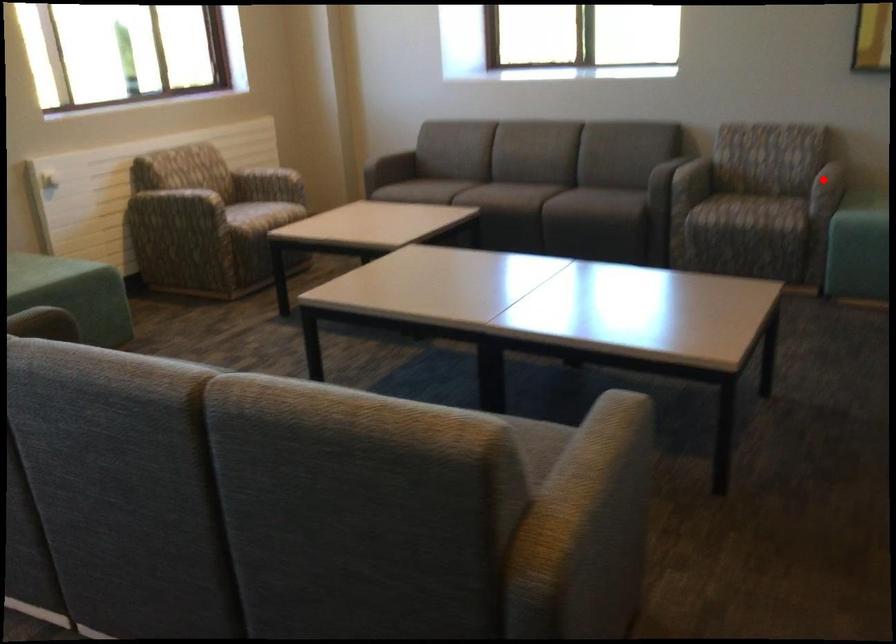
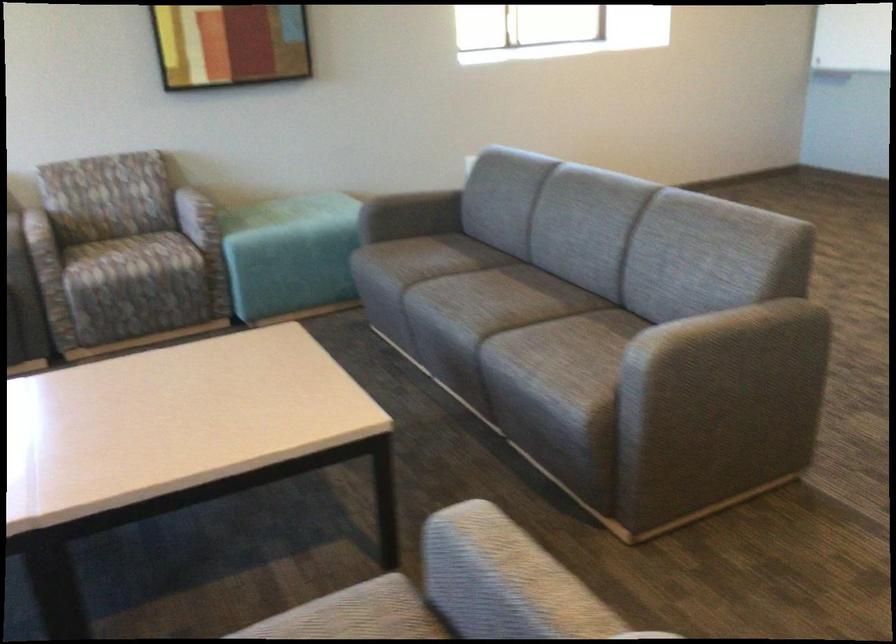
Question: I am providing you with two images of the same scene from different viewpoints. A red point is marked on the first image. At the location where the point appears in image 1, is it still visible in image 2?

Choices:
 (A) Yes
 (B) No

Answer: (B)